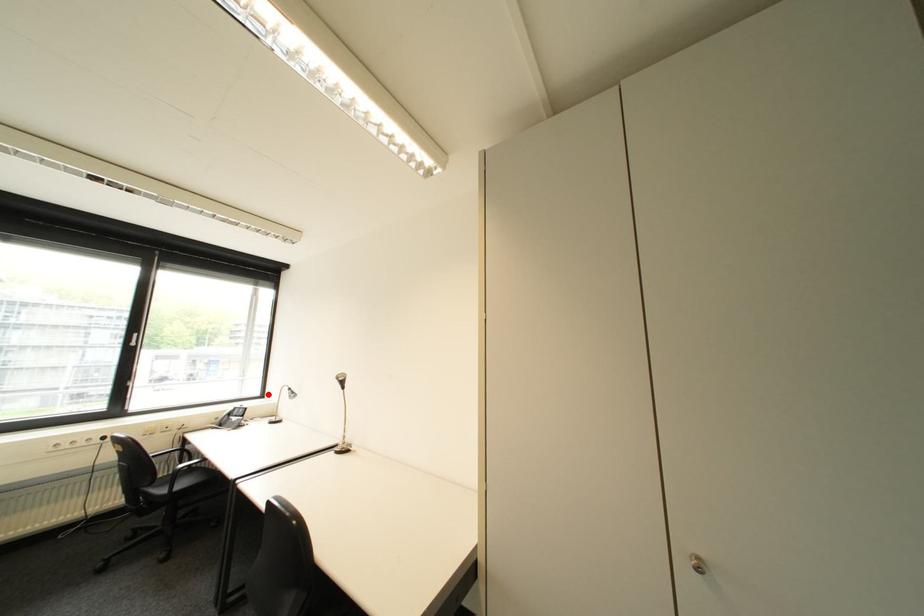
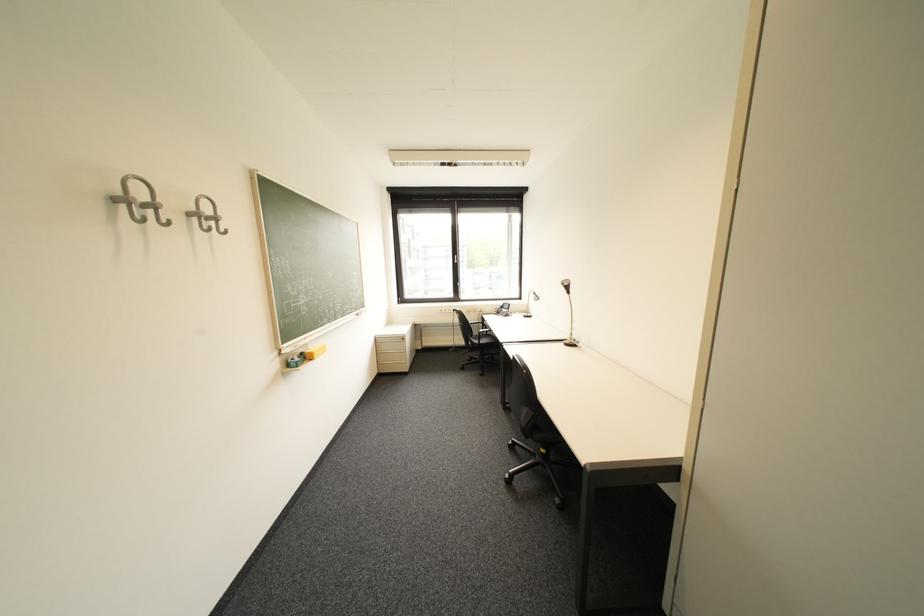
Locate, in the second image, the point that corresponds to the highlighted location in the first image.

(528, 297)